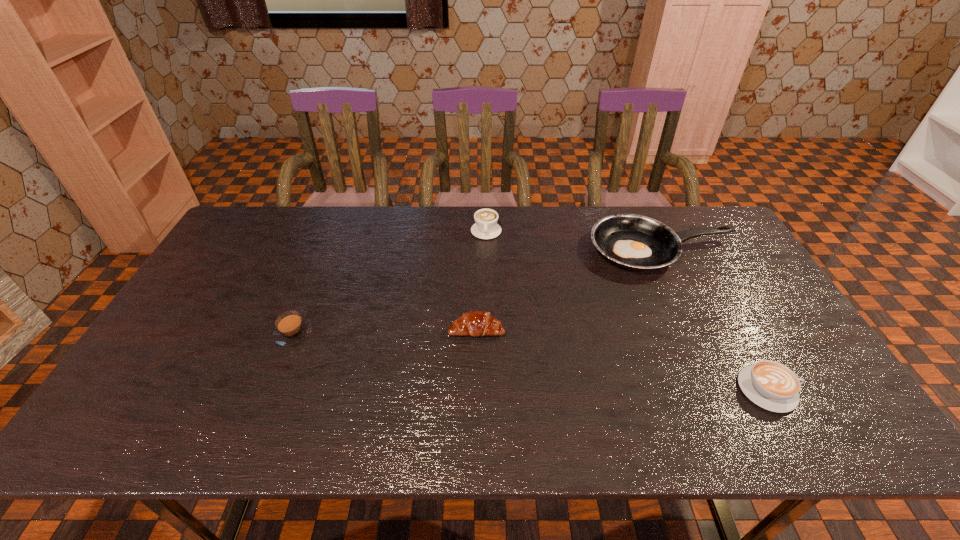
You are a GUI agent. You are given a task and a screenshot of the screen. Output one action in this format:
    pyautogui.click(x=<x>, y=<y>)
    Task: Click on the vacant space located on the back of the leftmost object
    The width and height of the screenshot is (960, 540).
    Given the screenshot: What is the action you would take?
    pyautogui.click(x=320, y=269)

Locate an element on the screen. The image size is (960, 540). vacant space located on the right of the crescent roll is located at coordinates (593, 329).

This screenshot has width=960, height=540. What are the coordinates of `free space located on the side of the rightmost cappuccino with the handle` in the screenshot? It's located at (830, 389).

In order to click on cappuccino located at the far edge in this screenshot , I will do `click(485, 227)`.

I want to click on frying pan located at the far edge, so click(x=635, y=242).

Locate an element on the screen. object situated at the near edge is located at coordinates (771, 385).

The image size is (960, 540). Find the location of `frying pan located at the right edge`. frying pan located at the right edge is located at coordinates 635,242.

At what (x,y) coordinates should I click in order to perform the action: click on cappuccino situated at the right edge. Please return your answer as a coordinate pair (x, y). Looking at the image, I should click on (771, 385).

The image size is (960, 540). I want to click on object that is at the far right corner, so pyautogui.click(x=635, y=242).

This screenshot has height=540, width=960. What are the coordinates of `object that is at the near right corner` in the screenshot? It's located at (771, 385).